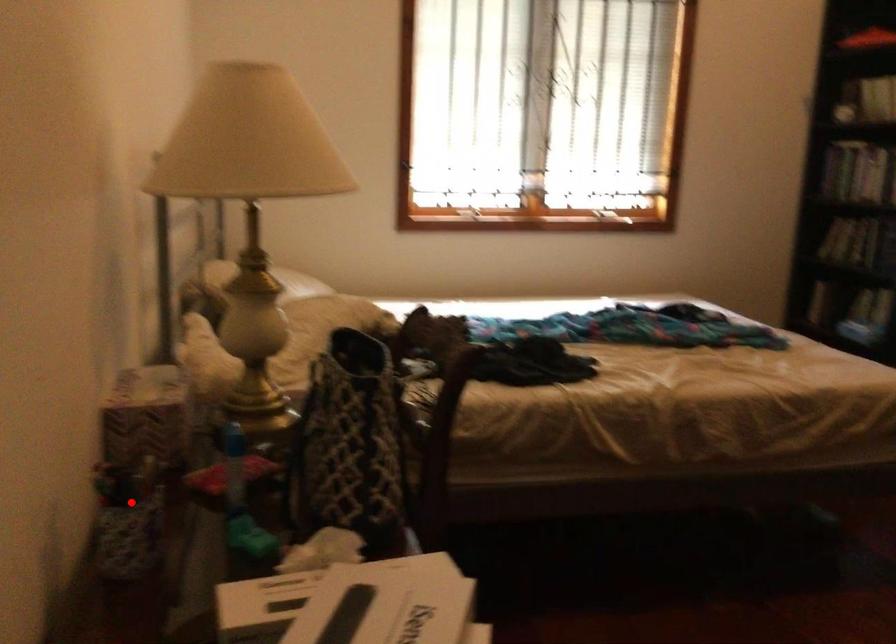
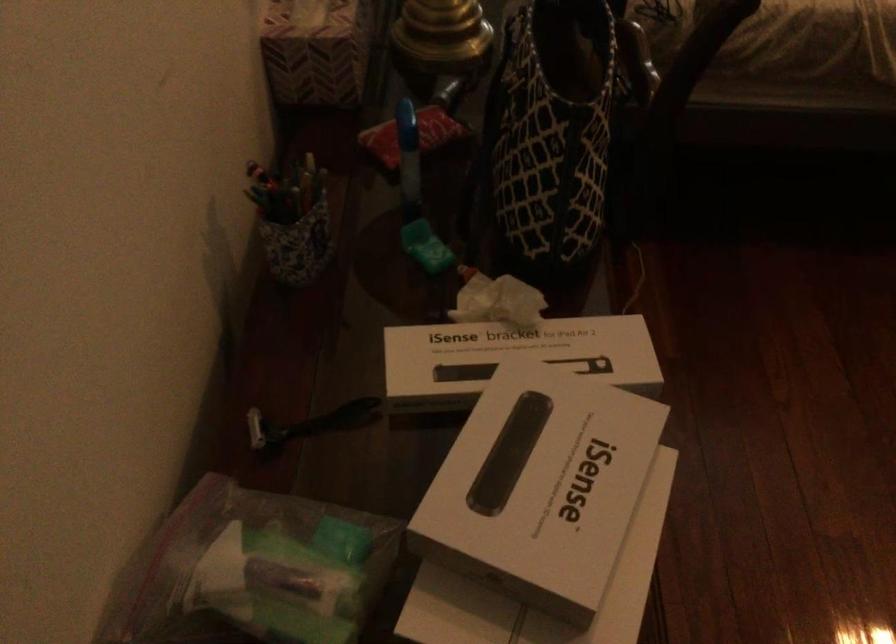
Question: I am providing you with two images of the same scene from different viewpoints. Image1 has a red point marked. In image2, the corresponding 3D location appears at what relative position? Reply with the corresponding letter.

Choices:
 (A) Closer
 (B) Farther

Answer: (A)